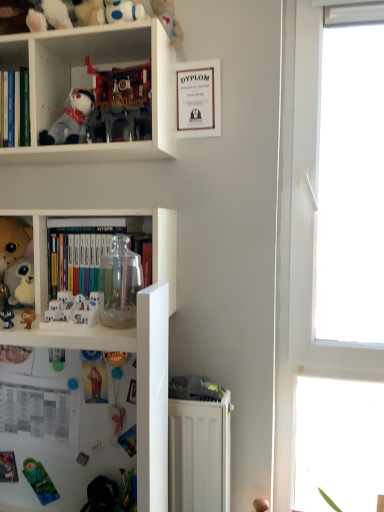
Find the location of a particular element. white plastic dice at lower left, arranged as the fourth toy when ordered from the bottom is located at coordinates (7, 317).

How much space does transparent glass jar at center, acting as the first book starting from the bottom, occupy horizontally?

6.30 inches.

Measure the distance between point (0, 261) and camera.

Point (0, 261) and camera are 1.24 meters apart from each other.

The height and width of the screenshot is (512, 384). Find the location of `matte plastic monkey at lower left, which is the 6th toy from top to bottom`. matte plastic monkey at lower left, which is the 6th toy from top to bottom is located at coordinates (28, 317).

Find the location of `green matte book at upper left, the 1th book in the left-to-right sequence`. green matte book at upper left, the 1th book in the left-to-right sequence is located at coordinates (17, 108).

Identify the location of pink fabric toy at lower center, arranged as the second toy when ordered from the bottom. This screenshot has width=384, height=512. (116, 418).

The height and width of the screenshot is (512, 384). What are the coordinates of `white plastic bookshelf at upper left, the first bookcase from the top` in the screenshot? It's located at coord(90,86).

Where is `white plastic dice at lower left, arranged as the fourth toy when ordered from the bottom`? The height and width of the screenshot is (512, 384). white plastic dice at lower left, arranged as the fourth toy when ordered from the bottom is located at coordinates (7, 317).

Based on the photo, is white plastic toy at lower left, the fifth toy from the bottom, facing away from pink fabric toy at lower center, positioned as the 7th toy in top-to-bottom order?

No, pink fabric toy at lower center, positioned as the 7th toy in top-to-bottom order, is not at the back of white plastic toy at lower left, the fifth toy from the bottom.

Considering the sizes of white plastic toy at lower left, arranged as the fourth toy when viewed from the top, and pink fabric toy at lower center, arranged as the second toy when ordered from the bottom, in the image, is white plastic toy at lower left, arranged as the fourth toy when viewed from the top, bigger or smaller than pink fabric toy at lower center, arranged as the second toy when ordered from the bottom,?

Clearly, white plastic toy at lower left, arranged as the fourth toy when viewed from the top, is larger in size than pink fabric toy at lower center, arranged as the second toy when ordered from the bottom.

Can you confirm if white plastic toy at lower left, arranged as the fourth toy when viewed from the top, is shorter than pink fabric toy at lower center, arranged as the second toy when ordered from the bottom?

Yes.

From the image's perspective, would you say white plastic toy at lower left, the fifth toy from the bottom, is shown under green matte book at upper left, which is counted as the 1th book, starting from the top?

Yes.

Considering the positions of point (46, 322) and point (14, 96), is point (46, 322) closer or farther from the camera than point (14, 96)?

Point (46, 322).

Is white plastic toy at lower left, the fifth toy from the bottom, taller or shorter than green matte book at upper left, the 2th book in the bottom-to-top sequence?

In the image, white plastic toy at lower left, the fifth toy from the bottom, appears to be shorter than green matte book at upper left, the 2th book in the bottom-to-top sequence.

Considering the relative sizes of white plastic toy at lower left, the fifth toy from the bottom, and green matte book at upper left, the 1th book in the left-to-right sequence, in the image provided, is white plastic toy at lower left, the fifth toy from the bottom, smaller than green matte book at upper left, the 1th book in the left-to-right sequence,?

Indeed, white plastic toy at lower left, the fifth toy from the bottom, has a smaller size compared to green matte book at upper left, the 1th book in the left-to-right sequence.

Considering the relative sizes of transparent glass window at right and pink fabric toy at lower center, arranged as the second toy when ordered from the bottom, in the image provided, is transparent glass window at right taller than pink fabric toy at lower center, arranged as the second toy when ordered from the bottom,?

Correct, transparent glass window at right is much taller as pink fabric toy at lower center, arranged as the second toy when ordered from the bottom.

Considering the relative positions of transparent glass window at right and pink fabric toy at lower center, arranged as the second toy when ordered from the bottom, in the image provided, is transparent glass window at right in front of pink fabric toy at lower center, arranged as the second toy when ordered from the bottom,?

No, it is not.

Is transparent glass window at right turned away from pink fabric toy at lower center, positioned as the 7th toy in top-to-bottom order?

That's not correct — transparent glass window at right is not looking away from pink fabric toy at lower center, positioned as the 7th toy in top-to-bottom order.

Looking at the image, does transparent glass window at right seem bigger or smaller compared to pink fabric toy at lower center, arranged as the second toy when ordered from the bottom?

In the image, transparent glass window at right appears to be larger than pink fabric toy at lower center, arranged as the second toy when ordered from the bottom.

Does transparent glass jar at center, acting as the first book starting from the bottom, appear on the left side of white plastic bookshelf at upper left, which is counted as the second bookcase, starting from the bottom?

Incorrect, transparent glass jar at center, acting as the first book starting from the bottom, is not on the left side of white plastic bookshelf at upper left, which is counted as the second bookcase, starting from the bottom.

From a real-world perspective, is transparent glass jar at center, arranged as the 2th book when viewed from the top, physically located above or below white plastic bookshelf at upper left, the first bookcase from the top?

Clearly, from a real-world perspective, transparent glass jar at center, arranged as the 2th book when viewed from the top, is below white plastic bookshelf at upper left, the first bookcase from the top.

Is white plastic bookshelf at upper left, which is counted as the second bookcase, starting from the bottom, at the back of transparent glass jar at center, acting as the first book starting from the bottom?

That's not correct — transparent glass jar at center, acting as the first book starting from the bottom, is not looking away from white plastic bookshelf at upper left, which is counted as the second bookcase, starting from the bottom.

From a real-world perspective, is green matte book at upper left, the 2th book in the bottom-to-top sequence, positioned over white plastic dice at lower left, the fifth toy viewed from the top, based on gravity?

Yes, from a real-world perspective, green matte book at upper left, the 2th book in the bottom-to-top sequence, is above white plastic dice at lower left, the fifth toy viewed from the top.

Is point (14, 119) positioned in front of point (1, 317)?

No, it is behind (1, 317).

Considering the positions of objects green matte book at upper left, the 2th book in the bottom-to-top sequence, and white plastic dice at lower left, arranged as the fourth toy when ordered from the bottom, in the image provided, who is more to the right, green matte book at upper left, the 2th book in the bottom-to-top sequence, or white plastic dice at lower left, arranged as the fourth toy when ordered from the bottom,?

white plastic dice at lower left, arranged as the fourth toy when ordered from the bottom.

In order to click on the 2nd book to the left of the transparent glass window at right, counting from the anchor's position in this screenshot , I will do `click(17, 108)`.

Is the surface of transparent glass window at right in direct contact with green matte book at upper left, which ranks as the 2th book in right-to-left order?

No, transparent glass window at right is not touching green matte book at upper left, which ranks as the 2th book in right-to-left order.

Does transparent glass window at right lie behind green matte book at upper left, which is counted as the 1th book, starting from the top?

Yes, it is behind green matte book at upper left, which is counted as the 1th book, starting from the top.

Does pink fabric toy at lower center, arranged as the second toy when ordered from the bottom, have a larger size compared to white plush toy at upper left, which is the 7th toy from bottom to top?

Actually, pink fabric toy at lower center, arranged as the second toy when ordered from the bottom, might be smaller than white plush toy at upper left, which is the 7th toy from bottom to top.

Considering the relative positions of pink fabric toy at lower center, arranged as the second toy when ordered from the bottom, and white plush toy at upper left, arranged as the second toy when viewed from the top, in the image provided, is pink fabric toy at lower center, arranged as the second toy when ordered from the bottom, to the right of white plush toy at upper left, arranged as the second toy when viewed from the top, from the viewer's perspective?

Yes.

From a real-world perspective, which object stands above the other?

white plush toy at upper left, which is the 7th toy from bottom to top, is physically above.

Is white plush toy at upper left, arranged as the second toy when viewed from the top, surrounded by pink fabric toy at lower center, positioned as the 7th toy in top-to-bottom order?

No, white plush toy at upper left, arranged as the second toy when viewed from the top, is not inside pink fabric toy at lower center, positioned as the 7th toy in top-to-bottom order.

What are the coordinates of `the 3rd toy positioned below the white plastic toy at lower left, arranged as the fourth toy when viewed from the top (from the image's perspective)` in the screenshot? It's located at (116, 418).

Where is `toy that is the 6th one when counting forward from the green matte book at upper left, which is counted as the 1th book, starting from the top`? toy that is the 6th one when counting forward from the green matte book at upper left, which is counted as the 1th book, starting from the top is located at coordinates (71, 311).

From the image, which object appears to be farther from pink fabric toy at lower center, arranged as the second toy when ordered from the bottom, white plastic bookshelf at upper left, which is counted as the second bookcase, starting from the bottom, or translucent plastic toy at lower left, marked as the first toy in a bottom-to-top arrangement?

white plastic bookshelf at upper left, which is counted as the second bookcase, starting from the bottom, is further to pink fabric toy at lower center, arranged as the second toy when ordered from the bottom.

Based on their spatial positions, is white plastic dice at lower left, the fifth toy viewed from the top, or transparent glass window at right closer to transparent glass jar at center?

Among the two, white plastic dice at lower left, the fifth toy viewed from the top, is located nearer to transparent glass jar at center.

Based on their spatial positions, is white plastic bookshelf at upper left, the first bookcase from the top, or white plastic toy at lower left, the fifth toy from the bottom, further from pink fabric toy at lower center, arranged as the second toy when ordered from the bottom?

white plastic bookshelf at upper left, the first bookcase from the top, is positioned further to the anchor pink fabric toy at lower center, arranged as the second toy when ordered from the bottom.

Looking at the image, which one is located further to matte plastic monkey at lower left, arranged as the third toy when ordered from the bottom, white plastic dice at lower left, the fifth toy viewed from the top, or fluffy plush toy at left, which is the 3th toy from top to bottom?

Among the two, fluffy plush toy at left, which is the 3th toy from top to bottom, is located further to matte plastic monkey at lower left, arranged as the third toy when ordered from the bottom.

When comparing their distances from matte plastic monkey at lower left, arranged as the third toy when ordered from the bottom, does white plastic toy at lower left, the fifth toy from the bottom, or white plush toy at upper left, arranged as the second toy when viewed from the top, seem closer?

Based on the image, white plastic toy at lower left, the fifth toy from the bottom, appears to be nearer to matte plastic monkey at lower left, arranged as the third toy when ordered from the bottom.

Estimate the real-world distances between objects in this image. Which object is further from pink fabric toy at lower center, arranged as the second toy when ordered from the bottom, transparent glass jar at center, arranged as the 2th book when viewed from the top, or matte plastic monkey at lower left, arranged as the third toy when ordered from the bottom?

The object further to pink fabric toy at lower center, arranged as the second toy when ordered from the bottom, is transparent glass jar at center, arranged as the 2th book when viewed from the top.

Considering their positions, is green matte book at upper left, the 1th book in the left-to-right sequence, positioned closer to transparent glass window at right than pink fabric toy at lower center, arranged as the second toy when ordered from the bottom?

pink fabric toy at lower center, arranged as the second toy when ordered from the bottom.

From the image, which object appears to be nearer to pink fabric toy at lower center, arranged as the second toy when ordered from the bottom, plastic red toy at upper left, the eighth toy when ordered from bottom to top, or matte plastic monkey at lower left, which is the 6th toy from top to bottom?

matte plastic monkey at lower left, which is the 6th toy from top to bottom.

Find the location of a particular element. This screenshot has width=384, height=512. book between green matte book at upper left, which ranks as the 2th book in right-to-left order, and transparent glass jar at center in the up-down direction is located at coordinates (82, 255).

Where is `glass jar located between white plastic bookcase at center, marked as the second bookcase in a top-to-bottom arrangement, and pink fabric toy at lower center, arranged as the second toy when ordered from the bottom, in the depth direction`? glass jar located between white plastic bookcase at center, marked as the second bookcase in a top-to-bottom arrangement, and pink fabric toy at lower center, arranged as the second toy when ordered from the bottom, in the depth direction is located at coordinates (119, 284).

Where is `glass jar between green matte book at upper left, which ranks as the 2th book in right-to-left order, and translucent plastic toy at lower left, marked as the first toy in a bottom-to-top arrangement, in the vertical direction`? This screenshot has width=384, height=512. glass jar between green matte book at upper left, which ranks as the 2th book in right-to-left order, and translucent plastic toy at lower left, marked as the first toy in a bottom-to-top arrangement, in the vertical direction is located at coordinates (119, 284).

I want to click on book between white plastic dice at lower left, the fifth toy viewed from the top, and transparent glass jar at center, so click(82, 255).